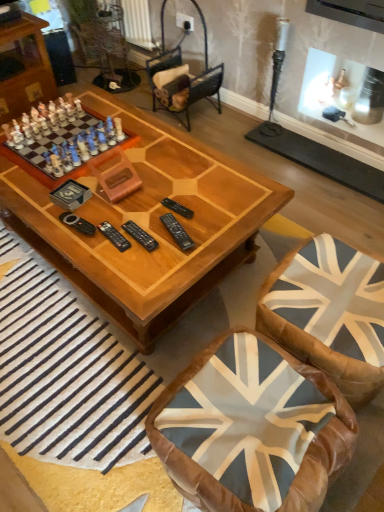
Question: Is velvet brown armchair at center wider or thinner than porcelain chess set at left?

Choices:
 (A) wide
 (B) thin

Answer: (B)

Question: From their relative heights in the image, would you say velvet brown armchair at center is taller or shorter than porcelain chess set at left?

Choices:
 (A) tall
 (B) short

Answer: (A)

Question: Which object is positioned closest to the leather union jack cushion at lower right?

Choices:
 (A) black plastic remote at center
 (B) wooden coffee table at center
 (C) porcelain chess set at left
 (D) blue fabric swivel chair at lower right
 (E) velvet brown armchair at center

Answer: (D)

Question: Estimate the real-world distances between objects in this image. Which object is farther from the black plastic remote at center?

Choices:
 (A) blue fabric swivel chair at lower right
 (B) leather union jack cushion at lower right
 (C) velvet brown armchair at center
 (D) wooden coffee table at center
 (E) porcelain chess set at left

Answer: (C)